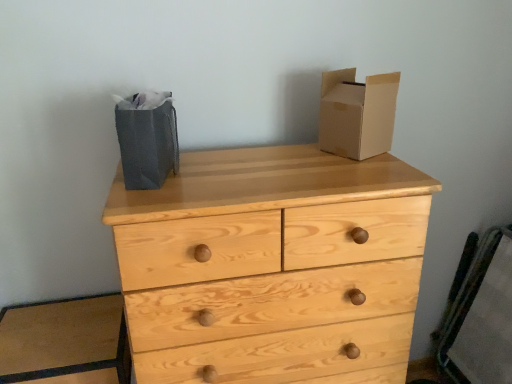
Question: Should I look upward or downward to see natural wood chest of drawers at center?

Choices:
 (A) down
 (B) up

Answer: (A)

Question: From the image's perspective, is cardboard box at upper right beneath natural wood chest of drawers at center?

Choices:
 (A) no
 (B) yes

Answer: (A)

Question: Considering the relative sizes of cardboard box at upper right and natural wood chest of drawers at center in the image provided, is cardboard box at upper right wider than natural wood chest of drawers at center?

Choices:
 (A) yes
 (B) no

Answer: (B)

Question: Can you confirm if cardboard box at upper right is positioned to the left of natural wood chest of drawers at center?

Choices:
 (A) no
 (B) yes

Answer: (A)

Question: Is cardboard box at upper right turned away from natural wood chest of drawers at center?

Choices:
 (A) no
 (B) yes

Answer: (A)

Question: Is cardboard box at upper right placed right next to natural wood chest of drawers at center?

Choices:
 (A) yes
 (B) no

Answer: (B)

Question: Is cardboard box at upper right located outside natural wood chest of drawers at center?

Choices:
 (A) no
 (B) yes

Answer: (B)

Question: Does gray paper bag at left have a greater width compared to natural wood chest of drawers at center?

Choices:
 (A) no
 (B) yes

Answer: (A)

Question: From a real-world perspective, is gray paper bag at left beneath natural wood chest of drawers at center?

Choices:
 (A) yes
 (B) no

Answer: (B)

Question: Does gray paper bag at left lie in front of natural wood chest of drawers at center?

Choices:
 (A) no
 (B) yes

Answer: (A)

Question: Is gray paper bag at left turned away from natural wood chest of drawers at center?

Choices:
 (A) no
 (B) yes

Answer: (A)

Question: Considering the relative positions of gray paper bag at left and natural wood chest of drawers at center in the image provided, is gray paper bag at left to the left of natural wood chest of drawers at center from the viewer's perspective?

Choices:
 (A) no
 (B) yes

Answer: (B)

Question: Does gray paper bag at left lie behind natural wood chest of drawers at center?

Choices:
 (A) no
 (B) yes

Answer: (B)

Question: From the image's perspective, does natural wood chest of drawers at center appear higher than gray paper bag at left?

Choices:
 (A) yes
 (B) no

Answer: (B)